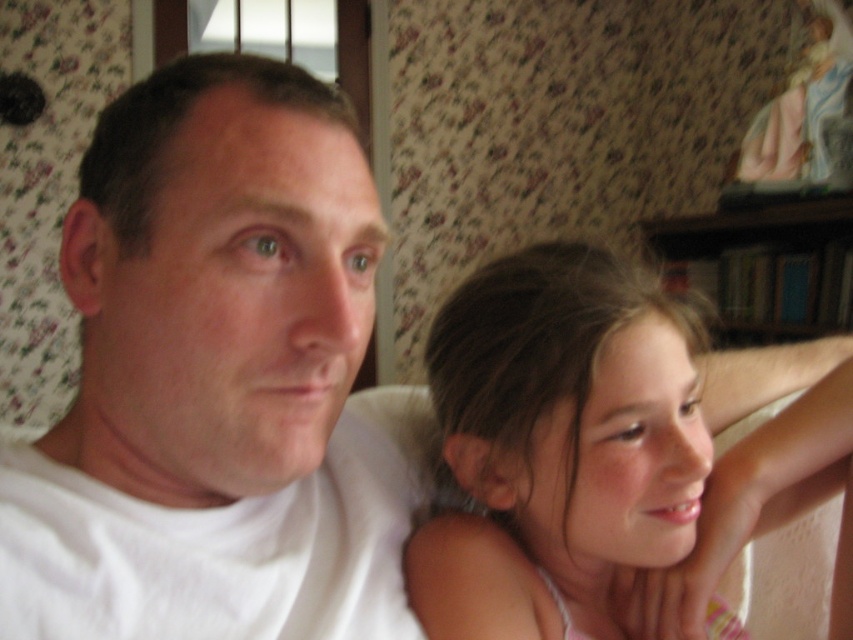
Question: Is light brown hair at center to the right of smooth skin face at center from the viewer's perspective?

Choices:
 (A) yes
 (B) no

Answer: (B)

Question: Which point is closer to the camera?

Choices:
 (A) pyautogui.click(x=679, y=481)
 (B) pyautogui.click(x=183, y=480)

Answer: (B)

Question: Among these points, which one is farthest from the camera?

Choices:
 (A) (462, 298)
 (B) (850, 445)
 (C) (157, 84)

Answer: (B)

Question: Observing the image, what is the correct spatial positioning of white matte shirt at upper left in reference to light brown hair at center?

Choices:
 (A) left
 (B) right

Answer: (A)

Question: Which object is farther from the camera taking this photo?

Choices:
 (A) white matte shirt at upper left
 (B) smooth skin face at center
 (C) light brown hair at center

Answer: (B)

Question: Is light brown hair at center behind smooth skin face at center?

Choices:
 (A) no
 (B) yes

Answer: (A)